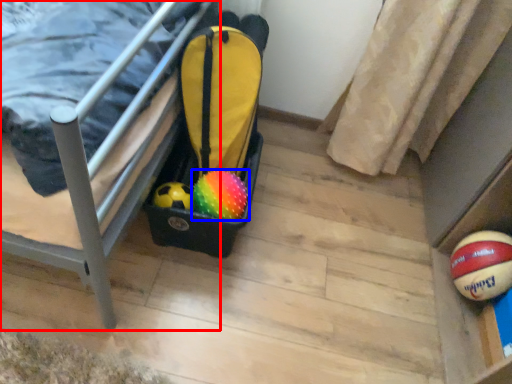
Question: Among these objects, which one is farthest to the camera, furniture (highlighted by a red box) or ball (highlighted by a blue box)?

Choices:
 (A) furniture
 (B) ball

Answer: (B)